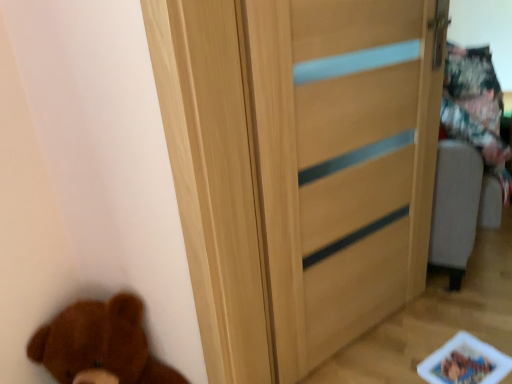
Question: In the image, is light wood door at center positioned in front of or behind brown plush bear at lower left?

Choices:
 (A) front
 (B) behind

Answer: (B)

Question: Considering the positions of point (200, 223) and point (39, 360), is point (200, 223) closer or farther from the camera than point (39, 360)?

Choices:
 (A) closer
 (B) farther

Answer: (A)

Question: From the image's perspective, relative to brown plush bear at lower left, is light wood door at center above or below?

Choices:
 (A) below
 (B) above

Answer: (B)

Question: Is brown plush bear at lower left in front of or behind light wood door at center in the image?

Choices:
 (A) behind
 (B) front

Answer: (B)

Question: Considering the positions of brown plush bear at lower left and light wood door at center in the image, is brown plush bear at lower left bigger or smaller than light wood door at center?

Choices:
 (A) big
 (B) small

Answer: (B)

Question: From the image's perspective, is brown plush bear at lower left located above or below light wood door at center?

Choices:
 (A) below
 (B) above

Answer: (A)

Question: Do you think brown plush bear at lower left is within light wood door at center, or outside of it?

Choices:
 (A) outside
 (B) inside

Answer: (A)